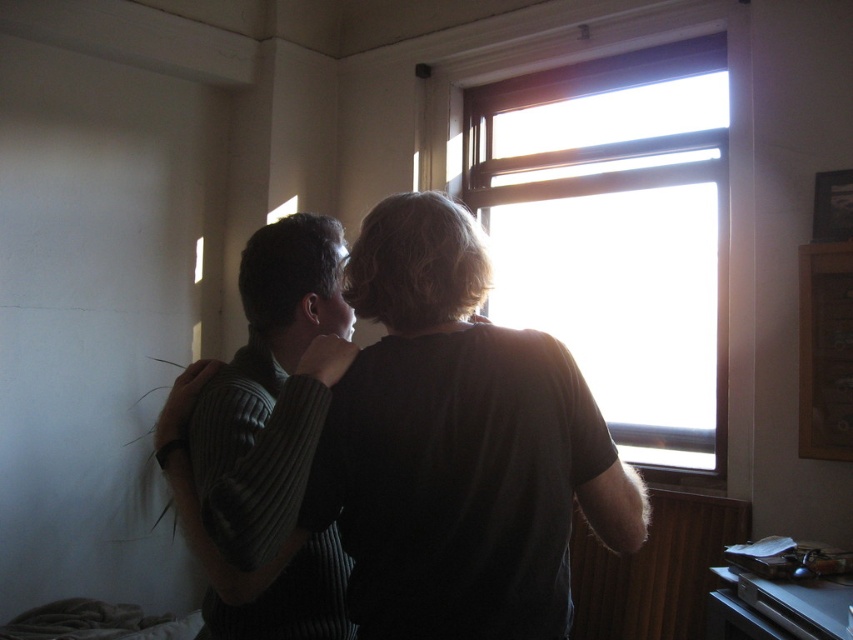
You are a tailor who needs to determine which of the two sweaters at the center of the image is wider. The sweaters are the dark gray sweater at center and the ribbed sweater at center. Based on the scene, which one has a greater width?

The dark gray sweater at center has a greater width than the ribbed sweater at center according to the description.

You are a photographer standing in the room and want to take a closeup photo of the dark gray sweater at center without including the wall with the discoloration. Is the distance between you and the sweater sufficient to fit the sweater in the frame while avoiding the damaged wall?

The dark gray sweater at center is 1.10 meters away from the camera. Since the sweater is positioned centrally and the damaged wall is on the left, maintaining this distance should allow the sweater to be framed without capturing the discolored area. However, this depends on the camera lens used and its focal length. A standard lens might require adjusting the position slightly closer or using a wider angle to ensure the sweater fills the frame while excluding the damaged wall.

You are a tailor measuring for a custom coat. You see the dark gray sweater at center and the transparent glass window at upper center. Which object is shorter in height?

The dark gray sweater at center is shorter in height compared to the transparent glass window at upper center.